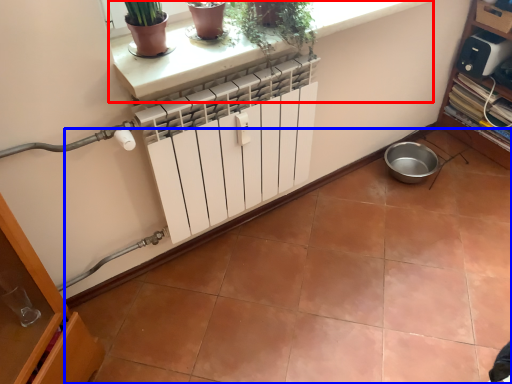
Question: Which point is closer to the camera, ledge (highlighted by a red box) or ceramic tile (highlighted by a blue box)?

Choices:
 (A) ledge
 (B) ceramic tile

Answer: (B)